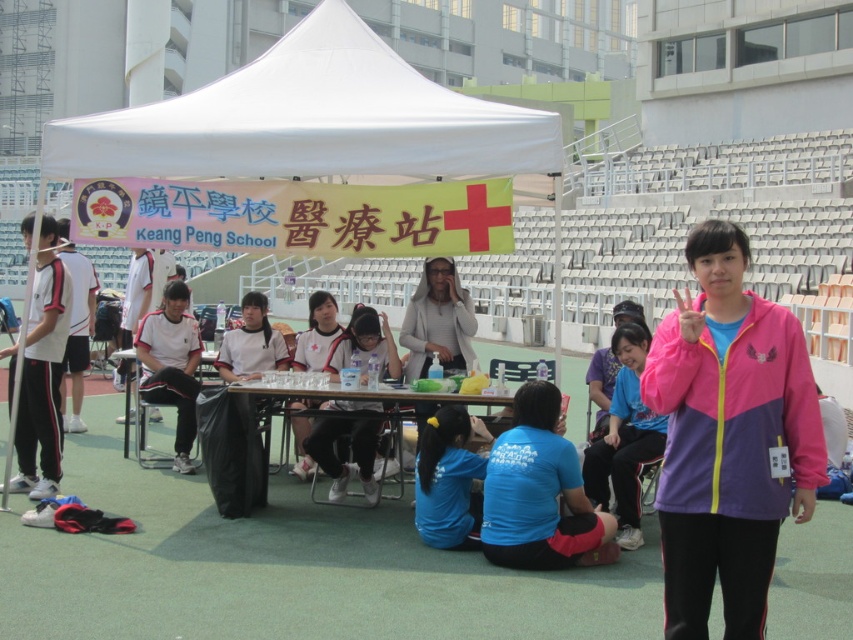
Looking at this image, what are the coordinates of the white fabric canopy at upper center in the image?

The white fabric canopy at upper center is located at coordinates (311, 120).

You are a photographer at the Keang Peng School event and need to take a group photo of the two people wearing the pink fabric jacket at center and white matte shirt at center. Since the camera frame can only accommodate one of them, which person should you focus on to ensure they fit within the frame?

The pink fabric jacket at center is larger in width than the white matte shirt at center, so focusing on the person wearing the pink fabric jacket at center will ensure they fit within the camera frame.

You are standing at the Keang Peng School event and need to move from point (x=397, y=56) to point (x=619, y=515). Which direction should you move in relation to the tent?

You should move away from the tent because point (x=397, y=56) is closer to the tent than point (x=619, y=515).